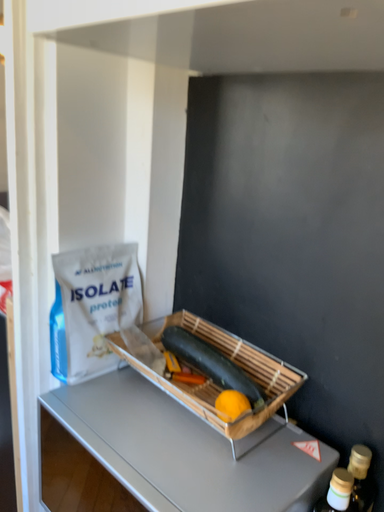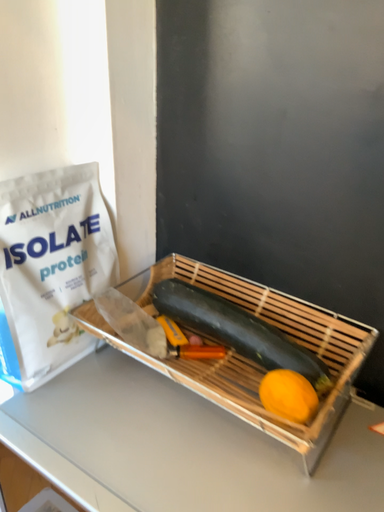
Question: How did the camera likely rotate when shooting the video?

Choices:
 (A) rotated right
 (B) rotated left

Answer: (A)